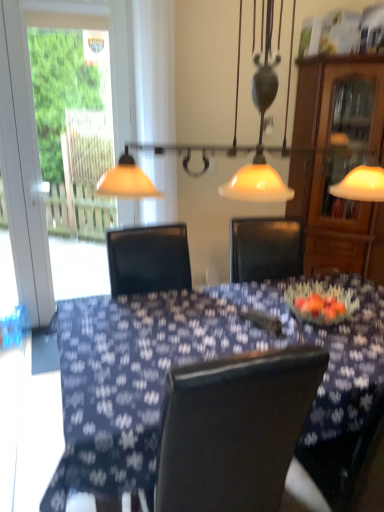
Question: Is matte glass pendant light at upper center in front of or behind wooden cabinet at right in the image?

Choices:
 (A) behind
 (B) front

Answer: (B)

Question: Considering the positions of point (220, 188) and point (339, 61), is point (220, 188) closer or farther from the camera than point (339, 61)?

Choices:
 (A) closer
 (B) farther

Answer: (B)

Question: Which of these objects is positioned farthest from the blue fabric table at center?

Choices:
 (A) transparent glass screen door at left
 (B) matte glass pendant light at upper center
 (C) wooden cabinet at right

Answer: (A)

Question: Which object is the farthest from the matte glass pendant light at upper center?

Choices:
 (A) transparent glass screen door at left
 (B) wooden cabinet at right
 (C) blue fabric table at center

Answer: (C)